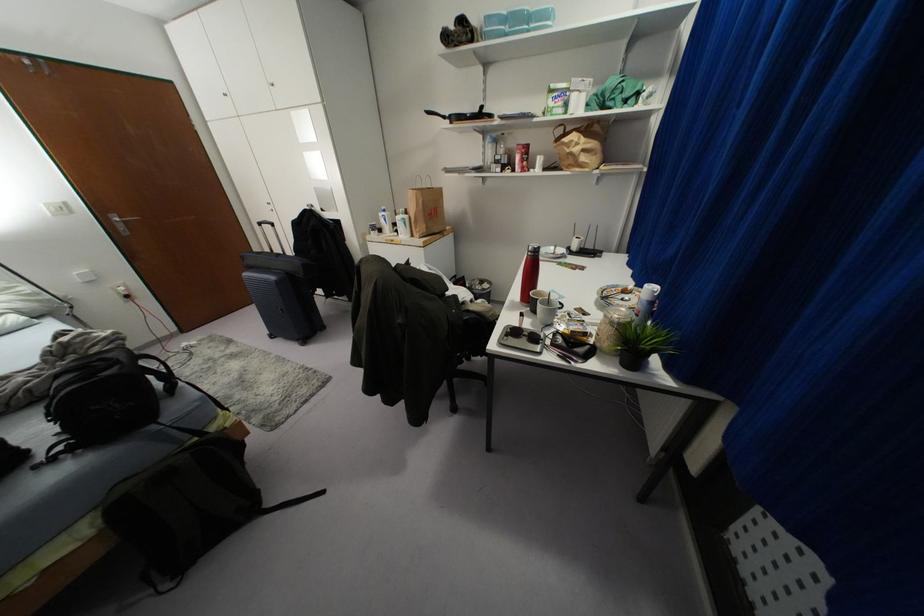
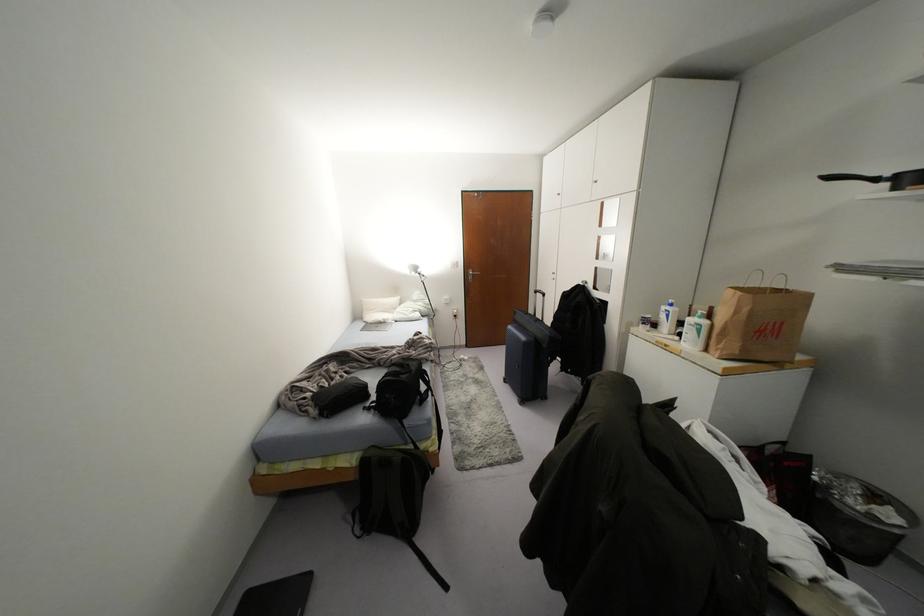
Find the pixel in the second image that matches point (405, 216) in the first image.

(703, 322)